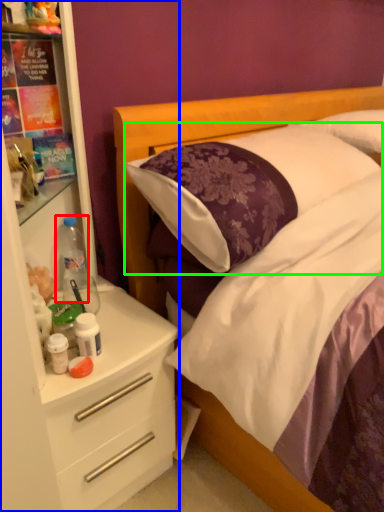
Question: Which object is positioned farthest from bottle (highlighted by a red box)? Select from dresser (highlighted by a blue box) and pillow (highlighted by a green box).

Choices:
 (A) dresser
 (B) pillow

Answer: (B)